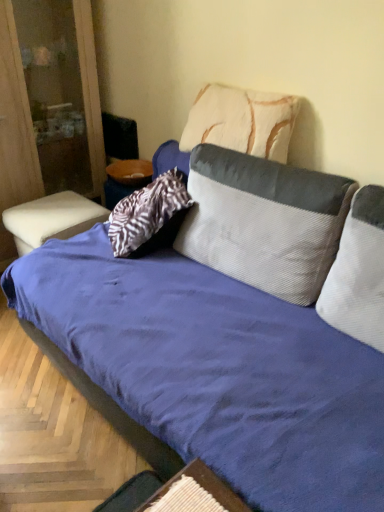
Question: Looking at the image, does white textured pillow at upper center, the 3th pillow ordered from the bottom, seem bigger or smaller compared to white leather ottoman at left?

Choices:
 (A) big
 (B) small

Answer: (B)

Question: Do you think white textured pillow at upper center, the 3th pillow ordered from the bottom, is within white leather ottoman at left, or outside of it?

Choices:
 (A) inside
 (B) outside

Answer: (B)

Question: Estimate the real-world distances between objects in this image. Which object is farther from the wooden textured table at lower center, the second table in the top-to-bottom sequence?

Choices:
 (A) white textured pillow at upper center, positioned as the 1th pillow in top-to-bottom order
 (B) corduroy gray pillow at center, which ranks as the 2th pillow in top-to-bottom order
 (C) white corduroy pillow at center, the third pillow when ordered from top to bottom
 (D) white leather ottoman at lower left, the first table positioned from the back
 (E) blue corduroy couch at center

Answer: (D)

Question: Which object is positioned farthest from the wooden textured table at lower center, the first table when ordered from right to left?

Choices:
 (A) white leather ottoman at lower left, placed as the second table when sorted from front to back
 (B) blue corduroy couch at center
 (C) corduroy gray pillow at center, which ranks as the 2th pillow in top-to-bottom order
 (D) white textured pillow at upper center, the 3th pillow ordered from the bottom
 (E) white corduroy pillow at center, the third pillow when ordered from top to bottom

Answer: (A)